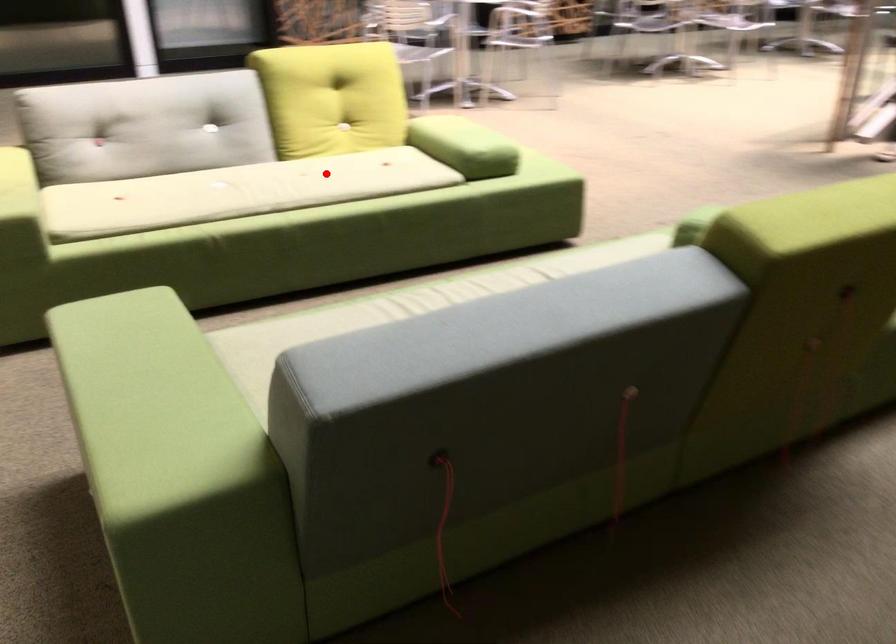
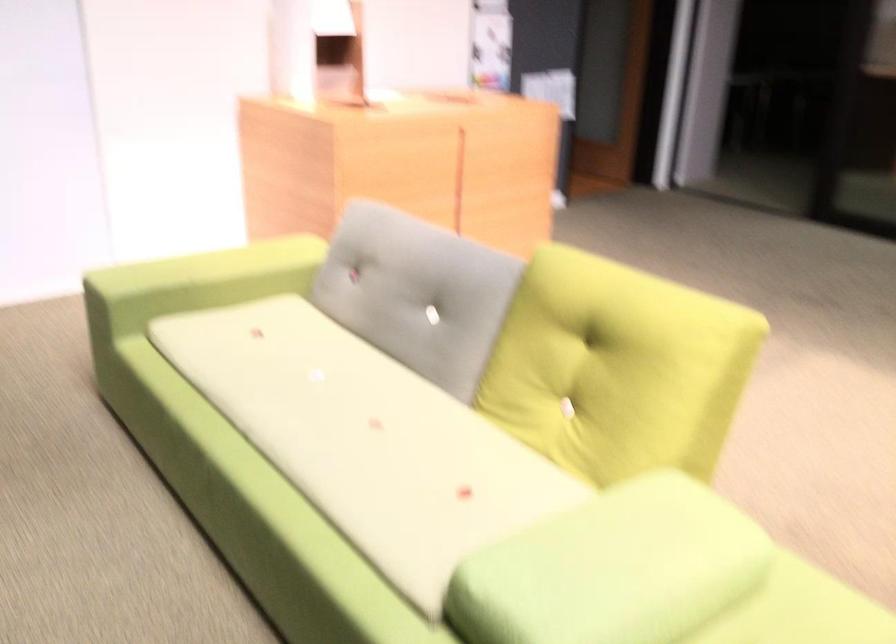
Where in the second image is the point corresponding to the highlighted location from the first image?

(366, 439)